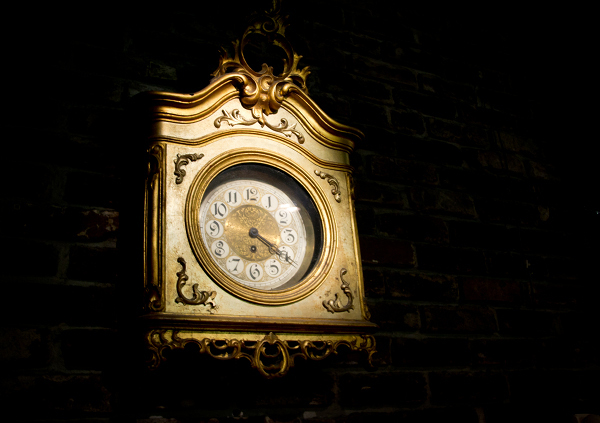
The image size is (600, 423). I want to click on gold clock case, so click(172, 204).